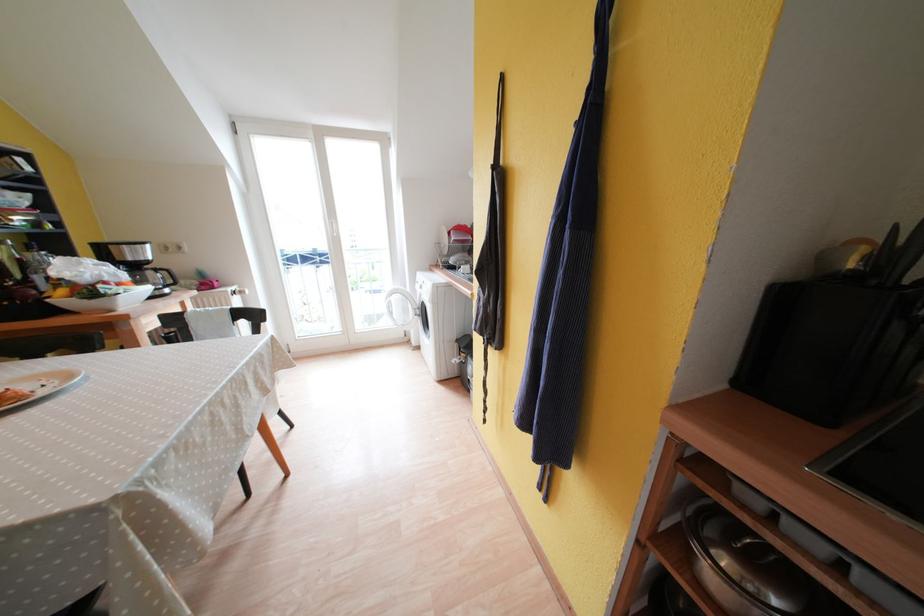
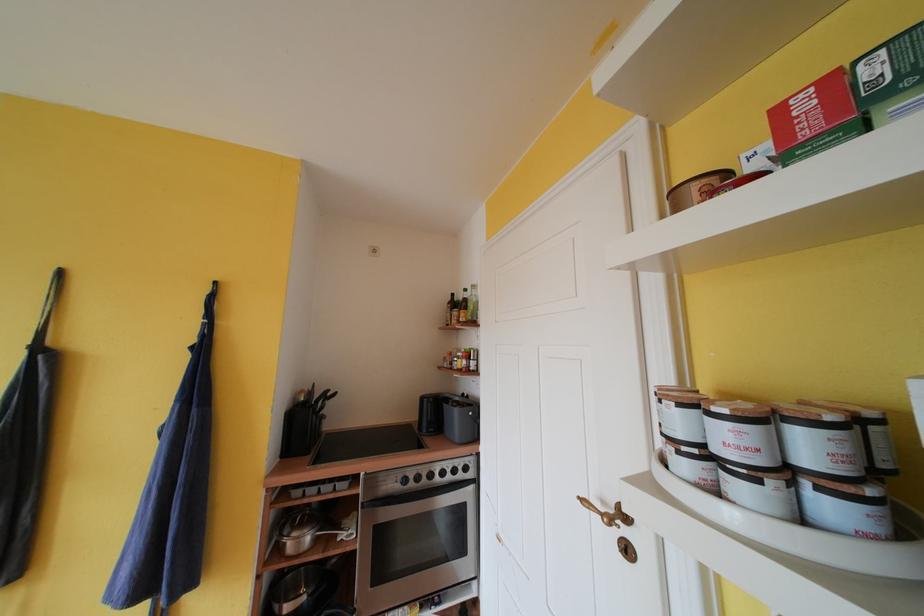
Locate, in the second image, the point that corresponds to pixel 825 261 in the first image.

(301, 402)